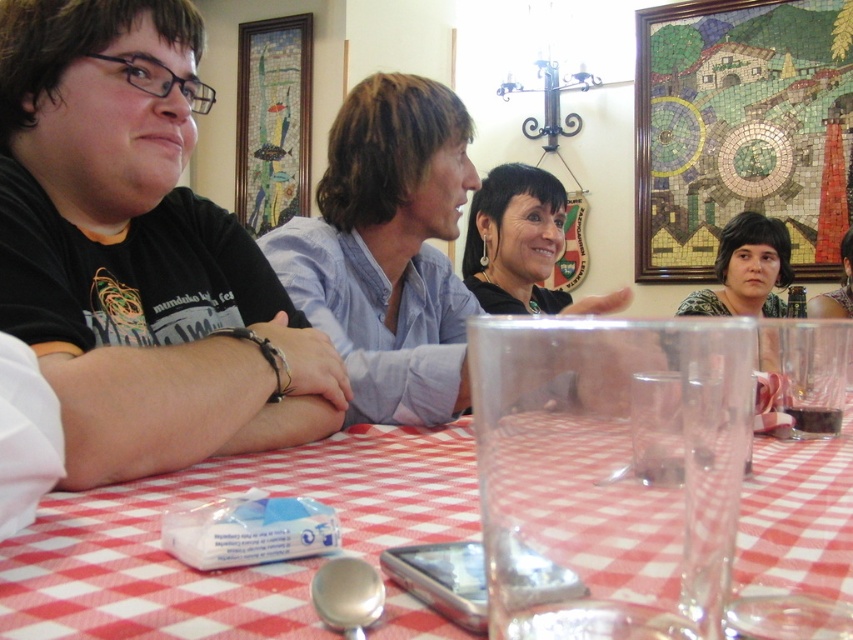
You are a photographer taking a portrait of the two people at the center of the table. You want to ensure that the matte black hair at center and the green floral blouse at center are both clearly visible in the frame. Based on their positions, which one should you focus on first to ensure proper focus?

The matte black hair at center is below the green floral blouse at center, so focusing on the green floral blouse at center first would ensure both are in focus since it is higher up and closer to the same plane.

You are a photographer trying to capture a closeup of the red checkered tablecloth at center and the green floral blouse at center. Since you want to focus on both, which object should you move closer to the camera to ensure they appear the same size in the photo?

The red checkered tablecloth at center is wider than the green floral blouse at center. To make them appear the same size in the photo, move the green floral blouse at center closer to the camera while keeping the red checkered tablecloth at center farther back, as wider objects can be positioned farther away and still appear large enough in the frame.